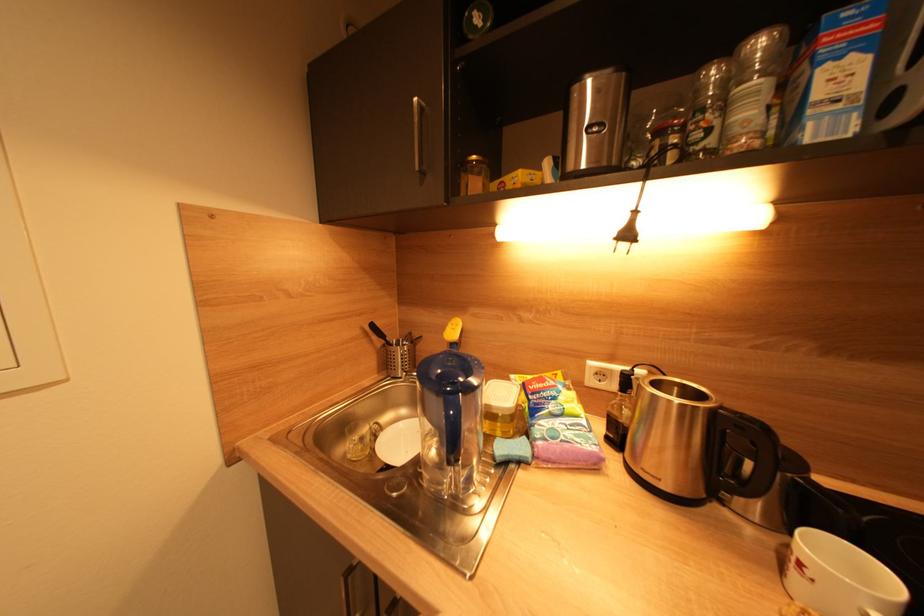
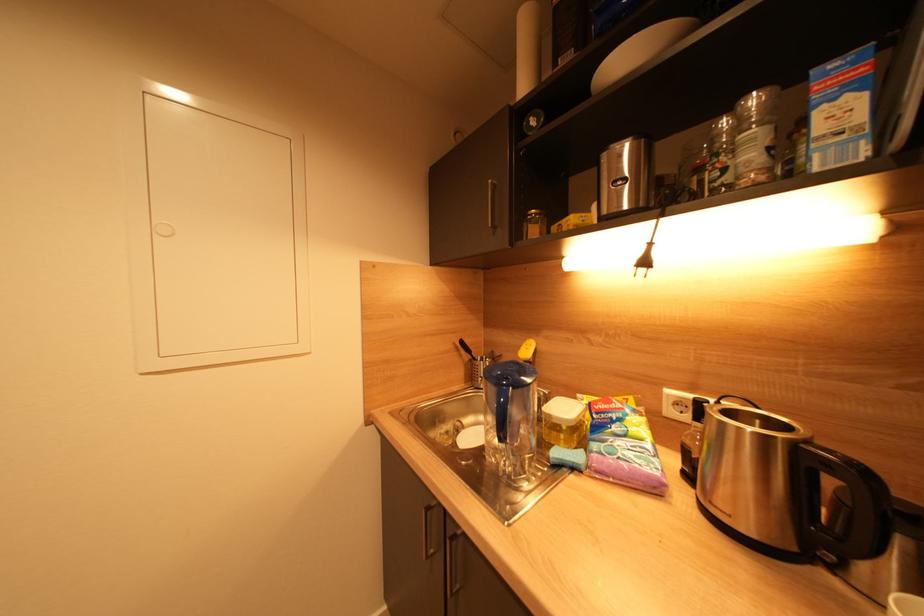
Question: The camera is either moving clockwise (left) or counter-clockwise (right) around the object. The first image is from the beginning of the video and the second image is from the end. Is the camera moving left or right when shooting the video?

Choices:
 (A) Left
 (B) Right

Answer: (B)